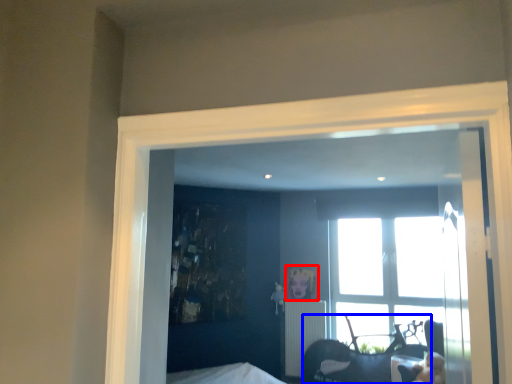
Question: Which object is further to the camera taking this photo, picture frame (highlighted by a red box) or furniture (highlighted by a blue box)?

Choices:
 (A) picture frame
 (B) furniture

Answer: (A)